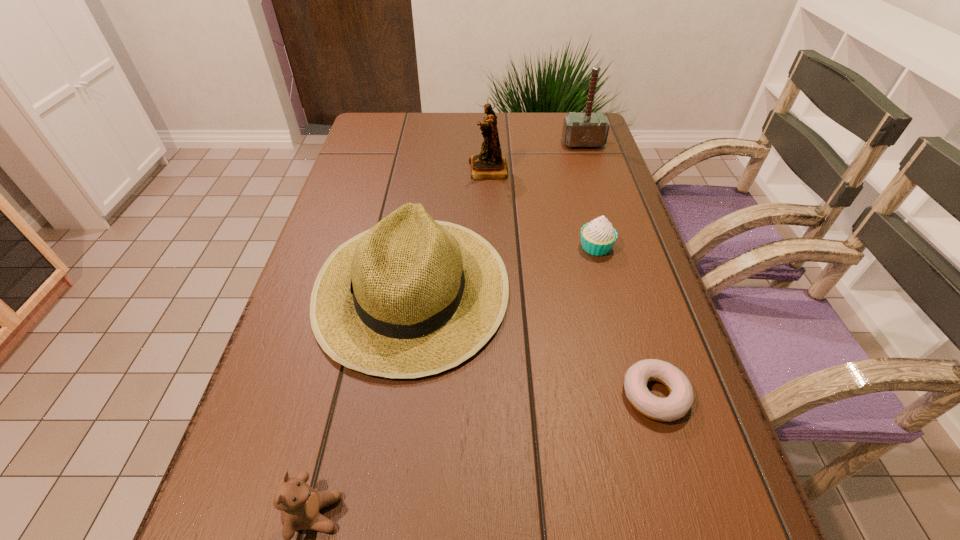
This screenshot has height=540, width=960. I want to click on blank space located 0.060m on the right of the cupcake, so click(x=639, y=247).

You are a GUI agent. You are given a task and a screenshot of the screen. Output one action in this format:
    pyautogui.click(x=<x>, y=<y>)
    Task: Click on the free location located on the back of the shortest object
    This screenshot has height=540, width=960.
    Given the screenshot: What is the action you would take?
    pyautogui.click(x=639, y=343)

Locate an element on the screen. object located at the far edge is located at coordinates (587, 129).

Identify the location of object that is positioned at the left edge. (411, 297).

At what (x,y) coordinates should I click in order to perform the action: click on hammer present at the right edge. Please return your answer as a coordinate pair (x, y). The height and width of the screenshot is (540, 960). Looking at the image, I should click on (587, 129).

The height and width of the screenshot is (540, 960). Find the location of `cupcake that is at the right edge`. cupcake that is at the right edge is located at coordinates (598, 236).

Find the location of `doughnut that is at the right edge`. doughnut that is at the right edge is located at coordinates (675, 406).

This screenshot has height=540, width=960. What are the coordinates of `object at the far right corner` in the screenshot? It's located at (587, 129).

Identify the location of vacant space at the left edge. (271, 386).

Where is `free region at the right edge of the desktop`? This screenshot has width=960, height=540. free region at the right edge of the desktop is located at coordinates (562, 168).